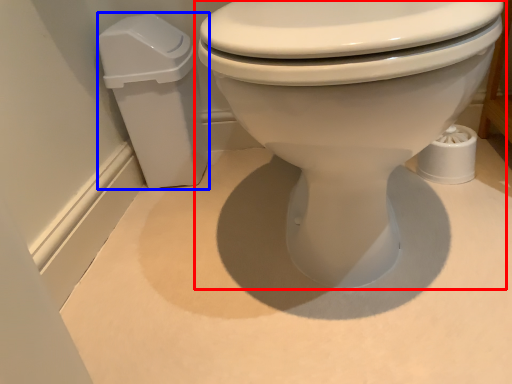
Question: Which object appears closest to the camera in this image, toilet (highlighted by a red box) or porcelain (highlighted by a blue box)?

Choices:
 (A) toilet
 (B) porcelain

Answer: (A)